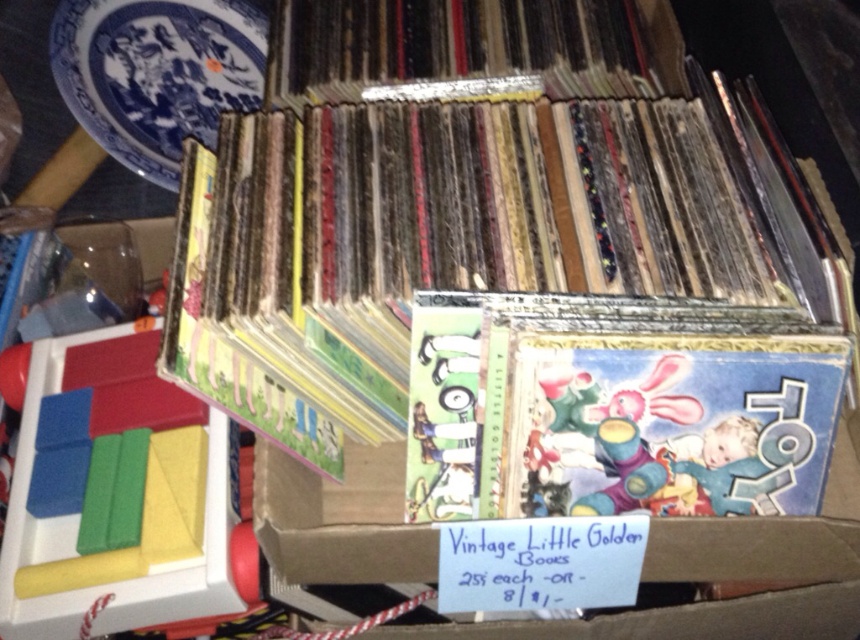
Question: Which object appears closest to the camera in this image?

Choices:
 (A) rubberized plastic blocks at left
 (B) blue porcelain plate at upper left

Answer: (A)

Question: Does rubberized plastic blocks at left have a smaller size compared to blue porcelain plate at upper left?

Choices:
 (A) yes
 (B) no

Answer: (A)

Question: Does rubberized plastic blocks at left have a greater width compared to blue porcelain plate at upper left?

Choices:
 (A) yes
 (B) no

Answer: (A)

Question: Among these objects, which one is nearest to the camera?

Choices:
 (A) rubberized plastic blocks at left
 (B) blue porcelain plate at upper left

Answer: (A)

Question: Can you confirm if rubberized plastic blocks at left is positioned below blue porcelain plate at upper left?

Choices:
 (A) no
 (B) yes

Answer: (B)